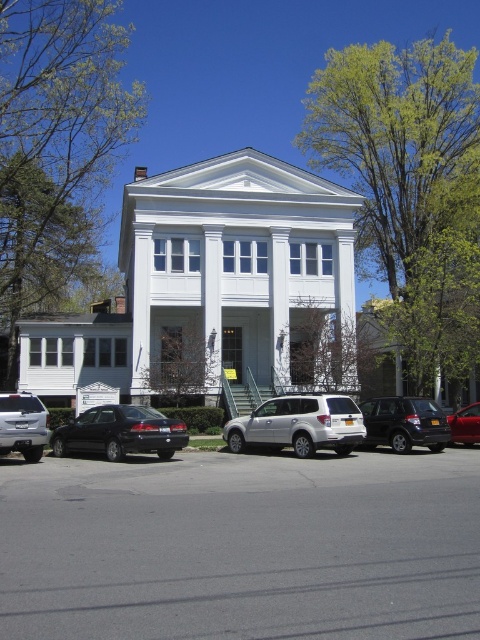
Question: Does satin silver suv at center appear on the right side of metallic red sedan at center?

Choices:
 (A) no
 (B) yes

Answer: (A)

Question: Which object is positioned closest to the satin silver suv at center?

Choices:
 (A) matte black suv at lower right
 (B) shiny black sedan at center
 (C) silver metallic sedan at lower left
 (D) metallic red sedan at center

Answer: (A)

Question: Which point is farther to the camera?

Choices:
 (A) metallic red sedan at center
 (B) shiny black sedan at center
 (C) matte black suv at lower right
 (D) satin silver suv at center

Answer: (A)

Question: Does satin silver suv at center have a smaller size compared to matte black suv at lower right?

Choices:
 (A) no
 (B) yes

Answer: (A)

Question: Can you confirm if shiny black sedan at center is positioned above matte black suv at lower right?

Choices:
 (A) yes
 (B) no

Answer: (B)

Question: Considering the real-world distances, which object is farthest from the metallic red sedan at center?

Choices:
 (A) matte black suv at lower right
 (B) satin silver suv at center

Answer: (B)